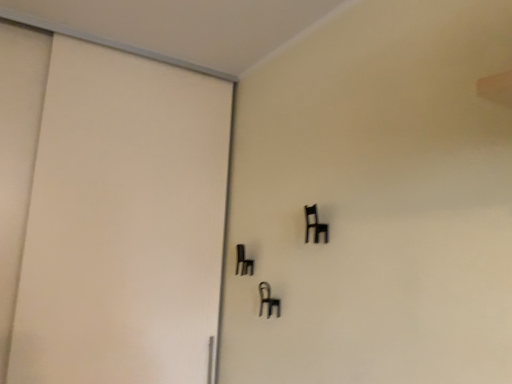
Question: Is matte white door at left wider than black plastic chair at upper right, which appears as the 1th furniture when viewed from the right?

Choices:
 (A) yes
 (B) no

Answer: (A)

Question: Is matte white door at left outside of black plastic chair at upper right, the 3th furniture from the left?

Choices:
 (A) yes
 (B) no

Answer: (A)

Question: From a real-world perspective, is matte white door at left positioned under black plastic chair at upper right, which is counted as the 1th furniture, starting from the top, based on gravity?

Choices:
 (A) no
 (B) yes

Answer: (B)

Question: Is matte white door at left bigger than black plastic chair at upper right, the 3th furniture positioned from the bottom?

Choices:
 (A) no
 (B) yes

Answer: (B)

Question: Would you say matte white door at left contains black plastic chair at upper right, the 1th furniture in the front-to-back sequence?

Choices:
 (A) no
 (B) yes

Answer: (A)

Question: Is matte white door at left in front of or behind black matte chair at center, which ranks as the 2th furniture in back-to-front order, in the image?

Choices:
 (A) front
 (B) behind

Answer: (A)

Question: Does point (46, 306) appear closer or farther from the camera than point (268, 311)?

Choices:
 (A) farther
 (B) closer

Answer: (B)

Question: From the image's perspective, relative to black matte chair at center, acting as the second furniture starting from the front, is matte white door at left above or below?

Choices:
 (A) above
 (B) below

Answer: (A)

Question: Is matte white door at left taller or shorter than black matte chair at center, placed as the 3th furniture when sorted from top to bottom?

Choices:
 (A) tall
 (B) short

Answer: (A)

Question: Looking at the image, does black matte chair at center, which is the second furniture in right-to-left order, seem bigger or smaller compared to black plastic chair at upper right, the 3th furniture from the left?

Choices:
 (A) big
 (B) small

Answer: (A)

Question: From a real-world perspective, relative to black plastic chair at upper right, which appears as the 1th furniture when viewed from the right, is black matte chair at center, placed as the 3th furniture when sorted from top to bottom, vertically above or below?

Choices:
 (A) above
 (B) below

Answer: (B)

Question: Considering the positions of black matte chair at center, which is the second furniture in right-to-left order, and black plastic chair at upper right, which is counted as the 1th furniture, starting from the top, in the image, is black matte chair at center, which is the second furniture in right-to-left order, wider or thinner than black plastic chair at upper right, which is counted as the 1th furniture, starting from the top,?

Choices:
 (A) wide
 (B) thin

Answer: (A)

Question: From the image's perspective, is black matte chair at center, acting as the second furniture starting from the front, positioned above or below black plastic chair at upper right, which appears as the 1th furniture when viewed from the right?

Choices:
 (A) below
 (B) above

Answer: (A)

Question: Choose the correct answer: Is black plastic chair at upper right, which appears as the 1th furniture when viewed from the right, inside matte white door at left or outside it?

Choices:
 (A) inside
 (B) outside

Answer: (B)

Question: From a real-world perspective, is black plastic chair at upper right, the 3th furniture positioned from the bottom, positioned above or below matte white door at left?

Choices:
 (A) below
 (B) above

Answer: (B)